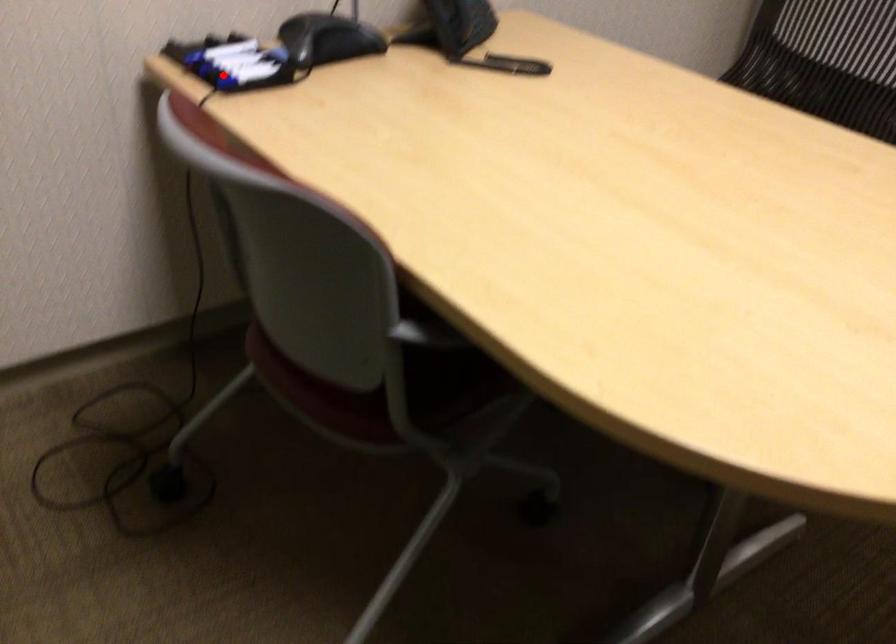
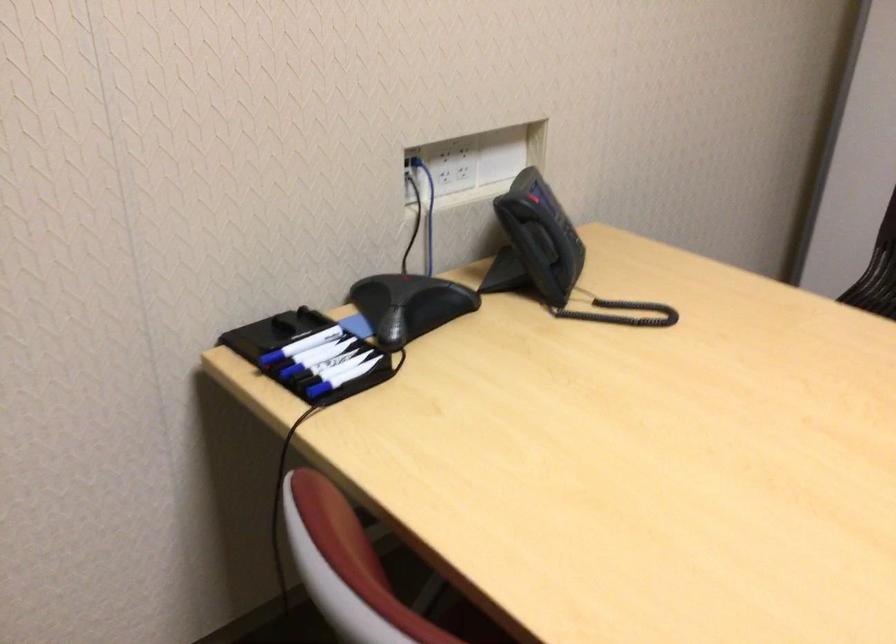
Question: I am providing you with two images of the same scene from different viewpoints. A red point is shown in image1. For the corresponding object point in image2, is it positioned nearer or farther from the camera?

Choices:
 (A) Nearer
 (B) Farther

Answer: (A)